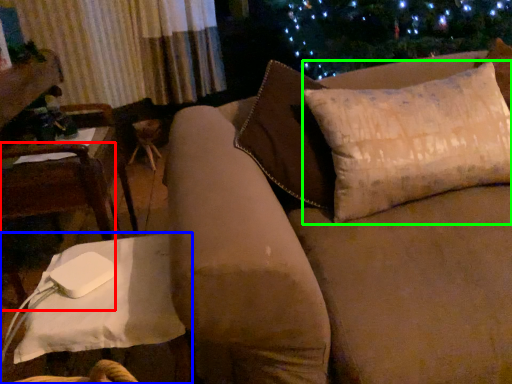
Question: Considering the real-world distances, which object is closest to chair (highlighted by a red box)? table (highlighted by a blue box) or pillow (highlighted by a green box).

Choices:
 (A) table
 (B) pillow

Answer: (A)